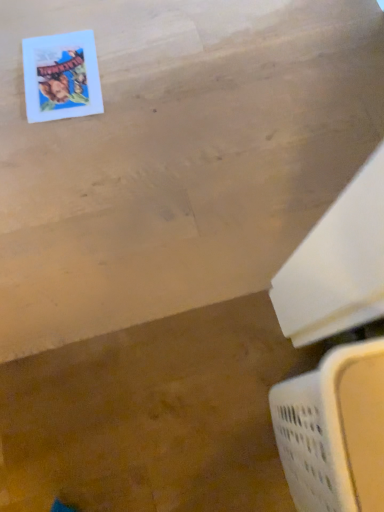
Question: From a real-world perspective, relative to white plastic laundry basket at lower right, is matte paper comic book at upper left vertically above or below?

Choices:
 (A) above
 (B) below

Answer: (B)

Question: Is point (92, 106) closer or farther from the camera than point (364, 442)?

Choices:
 (A) farther
 (B) closer

Answer: (A)

Question: From the image's perspective, relative to white plastic laundry basket at lower right, is matte paper comic book at upper left above or below?

Choices:
 (A) below
 (B) above

Answer: (B)

Question: Considering the relative positions of white plastic laundry basket at lower right and matte paper comic book at upper left in the image provided, is white plastic laundry basket at lower right to the left or to the right of matte paper comic book at upper left?

Choices:
 (A) left
 (B) right

Answer: (B)

Question: Is white plastic laundry basket at lower right situated inside matte paper comic book at upper left or outside?

Choices:
 (A) outside
 (B) inside

Answer: (A)

Question: Does point (302, 486) appear closer or farther from the camera than point (31, 109)?

Choices:
 (A) closer
 (B) farther

Answer: (A)

Question: From a real-world perspective, is white plastic laundry basket at lower right above or below matte paper comic book at upper left?

Choices:
 (A) below
 (B) above

Answer: (B)